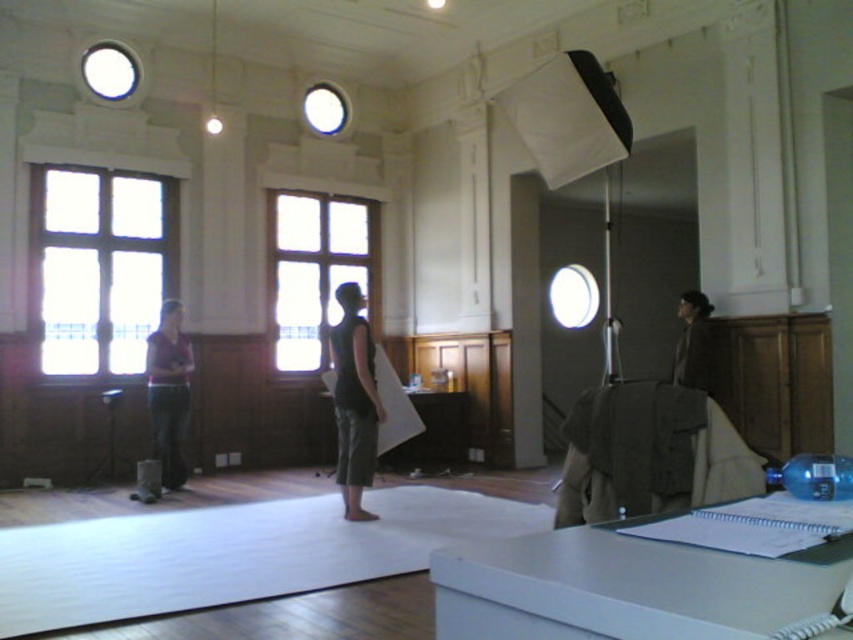
Describe the element at coordinates (100, 266) in the screenshot. I see `clear glass window at left` at that location.

Who is taller, clear glass window at left or black matte tank top at center?

clear glass window at left is taller.

You are a GUI agent. You are given a task and a screenshot of the screen. Output one action in this format:
    pyautogui.click(x=<x>, y=<y>)
    Task: Click on the clear glass window at left
    
    Given the screenshot: What is the action you would take?
    pyautogui.click(x=100, y=266)

Which is in front, point (48, 324) or point (700, 376)?

Point (700, 376) is in front.

Where is `clear glass window at left`? Image resolution: width=853 pixels, height=640 pixels. clear glass window at left is located at coordinates (100, 266).

Does clear glass window at center have a lesser width compared to black matte tank top at center?

No, clear glass window at center is not thinner than black matte tank top at center.

Who is more distant from viewer, (358, 257) or (357, 513)?

The point (358, 257) is behind.

Image resolution: width=853 pixels, height=640 pixels. In order to click on clear glass window at center in this screenshot , I will do `click(315, 268)`.